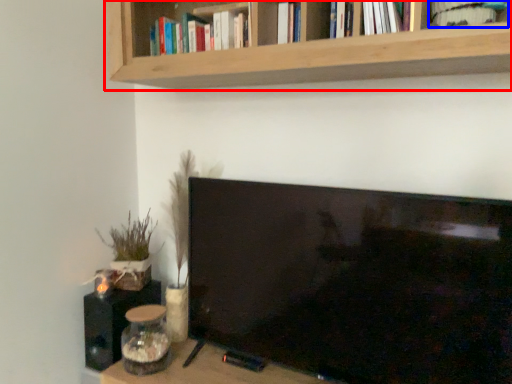
Question: Which of the following is the farthest to the observer, shelf (highlighted by a red box) or book (highlighted by a blue box)?

Choices:
 (A) shelf
 (B) book

Answer: (B)